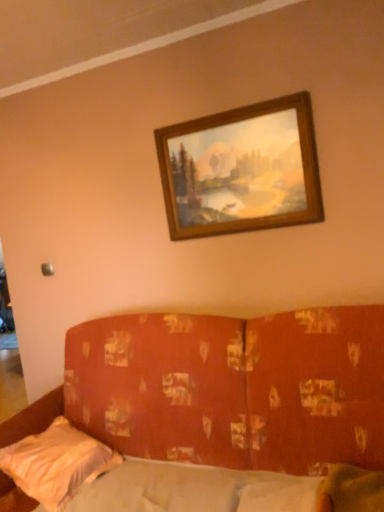
Question: Considering the relative sizes of white satin pillow at lower left and wooden frame at upper center in the image provided, is white satin pillow at lower left bigger than wooden frame at upper center?

Choices:
 (A) yes
 (B) no

Answer: (A)

Question: Considering the relative sizes of white satin pillow at lower left and wooden frame at upper center in the image provided, is white satin pillow at lower left thinner than wooden frame at upper center?

Choices:
 (A) yes
 (B) no

Answer: (B)

Question: Would you say white satin pillow at lower left is a long distance from wooden frame at upper center?

Choices:
 (A) yes
 (B) no

Answer: (A)

Question: Could wooden frame at upper center be considered to be inside white satin pillow at lower left?

Choices:
 (A) no
 (B) yes

Answer: (A)

Question: Does white satin pillow at lower left appear on the right side of wooden frame at upper center?

Choices:
 (A) yes
 (B) no

Answer: (B)

Question: Does point (100, 358) appear closer or farther from the camera than point (304, 196)?

Choices:
 (A) farther
 (B) closer

Answer: (A)

Question: Is textured orange fabric couch at center bigger or smaller than wooden frame at upper center?

Choices:
 (A) small
 (B) big

Answer: (B)

Question: In the image, is textured orange fabric couch at center positioned in front of or behind wooden frame at upper center?

Choices:
 (A) behind
 (B) front

Answer: (B)

Question: Visually, is textured orange fabric couch at center positioned to the left or to the right of wooden frame at upper center?

Choices:
 (A) right
 (B) left

Answer: (B)

Question: Is point (292, 322) positioned closer to the camera than point (162, 472)?

Choices:
 (A) closer
 (B) farther

Answer: (A)

Question: From a real-world perspective, is textured orange fabric couch at center physically located above or below white fabric mattress at lower center?

Choices:
 (A) below
 (B) above

Answer: (B)

Question: Visually, is textured orange fabric couch at center positioned to the left or to the right of white fabric mattress at lower center?

Choices:
 (A) right
 (B) left

Answer: (B)

Question: In terms of height, does textured orange fabric couch at center look taller or shorter compared to white fabric mattress at lower center?

Choices:
 (A) short
 (B) tall

Answer: (B)

Question: Is white satin pillow at lower left in front of or behind white fabric mattress at lower center in the image?

Choices:
 (A) behind
 (B) front

Answer: (A)

Question: From a real-world perspective, is white satin pillow at lower left physically located above or below white fabric mattress at lower center?

Choices:
 (A) above
 (B) below

Answer: (A)